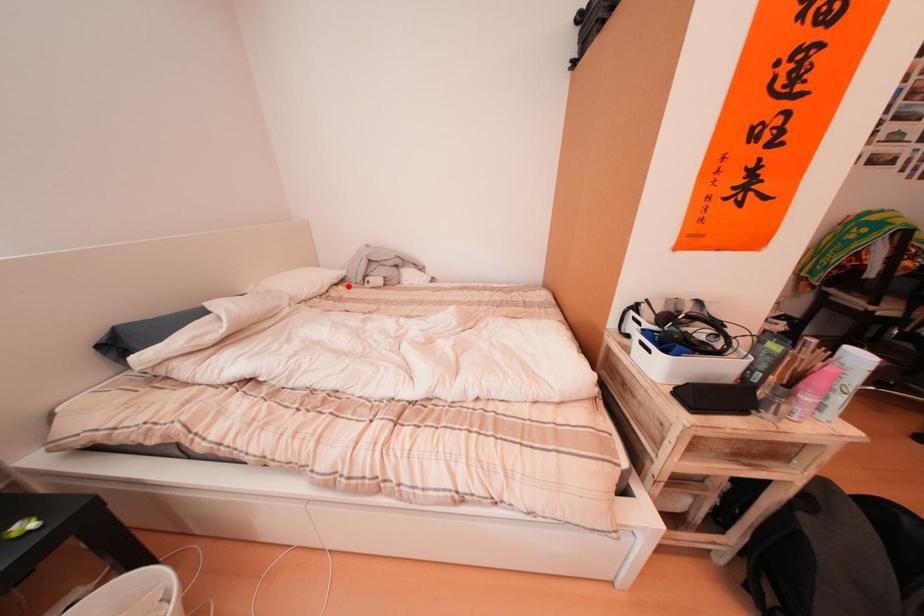
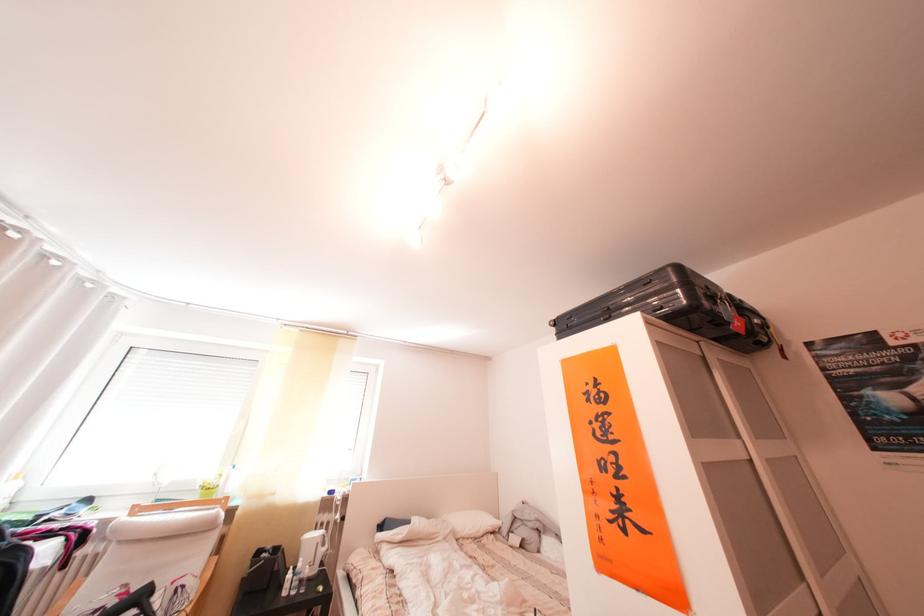
Question: A red point is marked in image1. In image2, is the corresponding 3D point closer to the camera or farther? Reply with the corresponding letter.

Choices:
 (A) The corresponding 3D point is closer.
 (B) The corresponding 3D point is farther.

Answer: (B)